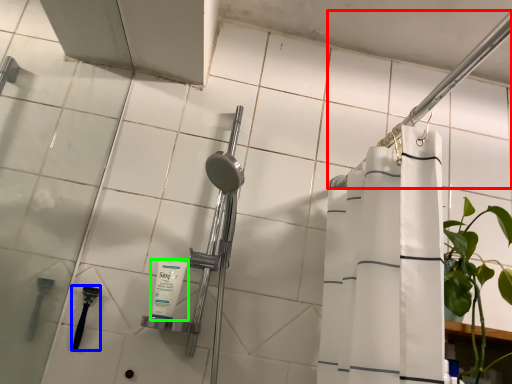
Question: Estimate the real-world distances between objects in this image. Which object is farther from shower (highlighted by a red box), shower (highlighted by a blue box) or toiletry (highlighted by a green box)?

Choices:
 (A) shower
 (B) toiletry

Answer: (A)